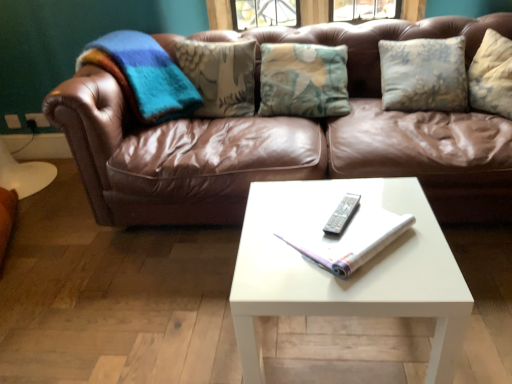
Question: From their relative heights in the image, would you say silver metallic remote at center is taller or shorter than white glossy coffee table at center?

Choices:
 (A) tall
 (B) short

Answer: (B)

Question: From a real-world perspective, is silver metallic remote at center above or below white glossy coffee table at center?

Choices:
 (A) above
 (B) below

Answer: (A)

Question: Which object is positioned closest to the white glossy coffee table at center?

Choices:
 (A) silver metallic remote at center
 (B) brown leather couch at center
 (C) white paper book at center

Answer: (C)

Question: Which object is the closest to the white paper book at center?

Choices:
 (A) brown leather couch at center
 (B) white glossy coffee table at center
 (C) silver metallic remote at center

Answer: (C)